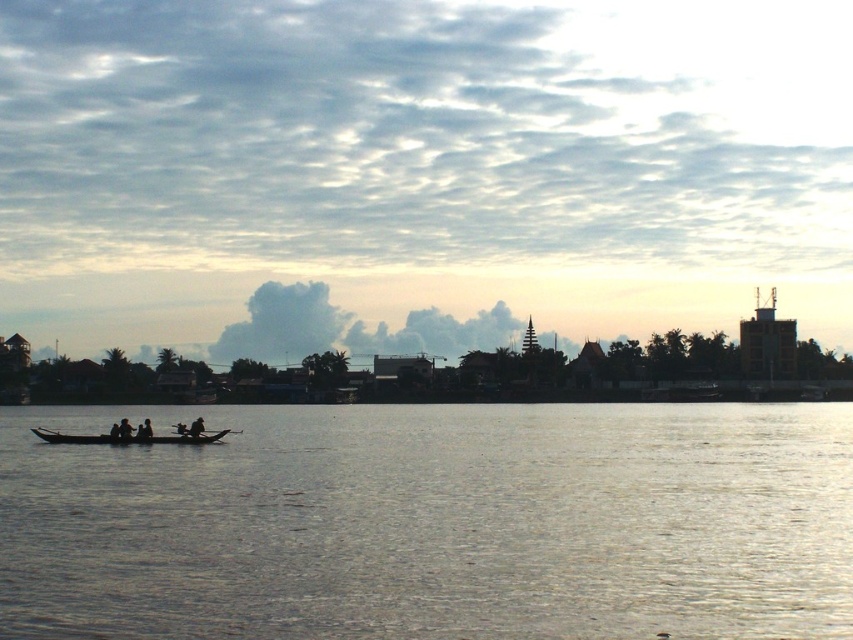
Can you confirm if wooden canoe at lower left is bigger than silhouette wooden boat at left?

Yes.

Which of these two, wooden canoe at lower left or silhouette wooden boat at left, stands shorter?

silhouette wooden boat at left is shorter.

Is point (64, 436) more distant than point (148, 422)?

Yes, it is behind point (148, 422).

The height and width of the screenshot is (640, 853). Identify the location of wooden canoe at lower left. (128, 436).

Can you confirm if silhouette wooden boat at left is positioned to the left of dark brown wooden boat at center?

Yes, silhouette wooden boat at left is to the left of dark brown wooden boat at center.

Describe the element at coordinates (144, 429) in the screenshot. I see `silhouette wooden boat at left` at that location.

Between point (143, 429) and point (200, 426), which one is positioned behind?

The point (143, 429) is more distant.

At what (x,y) coordinates should I click in order to perform the action: click on silhouette wooden boat at left. Please return your answer as a coordinate pair (x, y). Image resolution: width=853 pixels, height=640 pixels. Looking at the image, I should click on (144, 429).

Is silvery reflective water at center to the left of wooden canoe at lower left from the viewer's perspective?

In fact, silvery reflective water at center is to the right of wooden canoe at lower left.

Is silvery reflective water at center wider than wooden canoe at lower left?

Yes, silvery reflective water at center is wider than wooden canoe at lower left.

The height and width of the screenshot is (640, 853). I want to click on silvery reflective water at center, so click(434, 524).